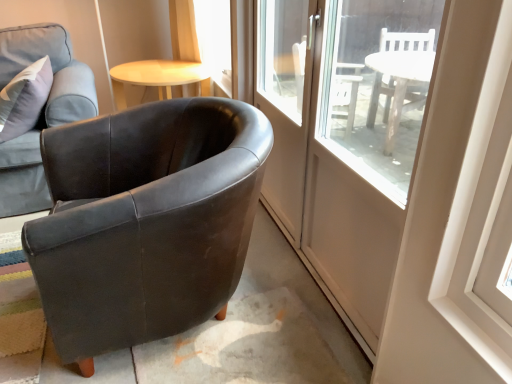
This screenshot has height=384, width=512. I want to click on clear glass door at center, so click(285, 100).

This screenshot has height=384, width=512. I want to click on light wood/woodenobject at upper center, so click(157, 77).

What do you see at coordinates (145, 220) in the screenshot? Image resolution: width=512 pixels, height=384 pixels. I see `matte black armchair at left, which appears as the first chair when viewed from the right` at bounding box center [145, 220].

This screenshot has width=512, height=384. What are the coordinates of `matte black armchair at left, which is the second chair from right to left` in the screenshot? It's located at (41, 111).

Is matte black armchair at left, which is counted as the 2th chair, starting from the left, thinner than clear glass door at center?

No.

Where is `screen door that is on the right side of matte black armchair at left, which is counted as the 2th chair, starting from the left`? Image resolution: width=512 pixels, height=384 pixels. screen door that is on the right side of matte black armchair at left, which is counted as the 2th chair, starting from the left is located at coordinates (285, 100).

From a real-world perspective, which is physically below, matte black armchair at left, which appears as the first chair when viewed from the right, or clear glass door at center?

matte black armchair at left, which appears as the first chair when viewed from the right, is physically lower.

Does light wood/woodenobject at upper center have a larger size compared to matte black armchair at left, which is counted as the 2th chair, starting from the left?

Incorrect, light wood/woodenobject at upper center is not larger than matte black armchair at left, which is counted as the 2th chair, starting from the left.

Which is behind, point (159, 72) or point (116, 324)?

Positioned behind is point (159, 72).

From the image's perspective, which object appears higher, light wood/woodenobject at upper center or matte black armchair at left, which appears as the first chair when viewed from the right?

light wood/woodenobject at upper center, from the image's perspective.

Is light wood/woodenobject at upper center outside of matte black armchair at left, which appears as the first chair when viewed from the right?

Yes, light wood/woodenobject at upper center is located beyond the bounds of matte black armchair at left, which appears as the first chair when viewed from the right.

How many degrees apart are the facing directions of light wood/woodenobject at upper center and matte black armchair at left, which is the second chair from right to left?

light wood/woodenobject at upper center and matte black armchair at left, which is the second chair from right to left, are facing 0.826 degrees away from each other.

Which is less distant, (x=118, y=65) or (x=61, y=83)?

Point (x=118, y=65).

Is matte black armchair at left, which is the second chair from right to left, surrounded by light wood/woodenobject at upper center?

No, matte black armchair at left, which is the second chair from right to left, is not surrounded by light wood/woodenobject at upper center.

Considering the sizes of objects light wood/woodenobject at upper center and matte black armchair at left, the first chair in the left-to-right sequence, in the image provided, who is bigger, light wood/woodenobject at upper center or matte black armchair at left, the first chair in the left-to-right sequence,?

matte black armchair at left, the first chair in the left-to-right sequence.

From the image's perspective, does clear glass door at center appear higher than matte black armchair at left, which appears as the first chair when viewed from the right?

Yes.

Could you tell me if clear glass door at center is facing matte black armchair at left, which appears as the first chair when viewed from the right?

Yes, clear glass door at center is facing matte black armchair at left, which appears as the first chair when viewed from the right.

Is clear glass door at center in front of matte black armchair at left, which appears as the first chair when viewed from the right?

No, clear glass door at center is behind matte black armchair at left, which appears as the first chair when viewed from the right.

Does clear glass door at center contain matte black armchair at left, which is counted as the 2th chair, starting from the left?

No, clear glass door at center does not contain matte black armchair at left, which is counted as the 2th chair, starting from the left.

From the image's perspective, which is below, matte black armchair at left, which is the second chair from right to left, or clear glass door at center?

From the image's view, clear glass door at center is below.

From a real-world perspective, which is physically above, matte black armchair at left, the first chair in the left-to-right sequence, or clear glass door at center?

Answer: In real-world perspective, clear glass door at center is above.

Considering the positions of objects matte black armchair at left, which is the second chair from right to left, and clear glass door at center in the image provided, who is behind, matte black armchair at left, which is the second chair from right to left, or clear glass door at center?

matte black armchair at left, which is the second chair from right to left.

From the image's perspective, which is below, clear glass door at center or light wood/woodenobject at upper center?

clear glass door at center.

Consider the image. Can you confirm if clear glass door at center is shorter than light wood/woodenobject at upper center?

In fact, clear glass door at center may be taller than light wood/woodenobject at upper center.

Which object is closer to the camera, clear glass door at center or light wood/woodenobject at upper center?

clear glass door at center is in front.

How many degrees apart are the facing directions of matte black armchair at left, which appears as the first chair when viewed from the right, and light wood/woodenobject at upper center?

91.7 degrees.

Who is taller, matte black armchair at left, which appears as the first chair when viewed from the right, or light wood/woodenobject at upper center?

Standing taller between the two is matte black armchair at left, which appears as the first chair when viewed from the right.

From the image's perspective, count 2nd chairs downward from the light wood/woodenobject at upper center and point to it. Please provide its 2D coordinates.

[(145, 220)]

In the scene shown: Which of these two, matte black armchair at left, which is counted as the 2th chair, starting from the left, or light wood/woodenobject at upper center, is thinner?

Thinner between the two is light wood/woodenobject at upper center.

Identify the location of chair in front of the clear glass door at center. (145, 220).

At what (x,y) coordinates should I click in order to perform the action: click on chair to the right of light wood/woodenobject at upper center. Please return your answer as a coordinate pair (x, y). This screenshot has width=512, height=384. Looking at the image, I should click on (145, 220).

Which object lies nearer to the anchor point clear glass door at center, matte black armchair at left, which is the second chair from right to left, or matte black armchair at left, which is counted as the 2th chair, starting from the left?

Based on the image, matte black armchair at left, which is counted as the 2th chair, starting from the left, appears to be nearer to clear glass door at center.

Considering their positions, is matte black armchair at left, which appears as the first chair when viewed from the right, positioned further to clear glass door at center than light wood/woodenobject at upper center?

Based on the image, light wood/woodenobject at upper center appears to be further to clear glass door at center.

Looking at the image, which one is located further to matte black armchair at left, which appears as the first chair when viewed from the right, matte black armchair at left, which is the second chair from right to left, or clear glass door at center?

matte black armchair at left, which is the second chair from right to left, is further to matte black armchair at left, which appears as the first chair when viewed from the right.

From the image, which object appears to be nearer to light wood/woodenobject at upper center, clear glass door at center or matte black armchair at left, the first chair in the left-to-right sequence?

matte black armchair at left, the first chair in the left-to-right sequence.

Based on their spatial positions, is matte black armchair at left, which appears as the first chair when viewed from the right, or matte black armchair at left, the first chair in the left-to-right sequence, further from clear glass door at center?

Based on the image, matte black armchair at left, the first chair in the left-to-right sequence, appears to be further to clear glass door at center.

When comparing their distances from light wood/woodenobject at upper center, does matte black armchair at left, the first chair in the left-to-right sequence, or clear glass door at center seem closer?

matte black armchair at left, the first chair in the left-to-right sequence, lies closer to light wood/woodenobject at upper center than the other object.

Based on their spatial positions, is clear glass door at center or light wood/woodenobject at upper center further from matte black armchair at left, which is counted as the 2th chair, starting from the left?

light wood/woodenobject at upper center lies further to matte black armchair at left, which is counted as the 2th chair, starting from the left, than the other object.

Based on their spatial positions, is light wood/woodenobject at upper center or matte black armchair at left, the first chair in the left-to-right sequence, closer to clear glass door at center?

light wood/woodenobject at upper center lies closer to clear glass door at center than the other object.

The height and width of the screenshot is (384, 512). In order to click on chair located between matte black armchair at left, the first chair in the left-to-right sequence, and clear glass door at center in the left-right direction in this screenshot , I will do `click(145, 220)`.

Find the location of a particular element. This screenshot has height=384, width=512. screen door between matte black armchair at left, which appears as the first chair when viewed from the right, and light wood/woodenobject at upper center, along the z-axis is located at coordinates (285, 100).

At what (x,y) coordinates should I click in order to perform the action: click on chair between matte black armchair at left, which is counted as the 2th chair, starting from the left, and light wood/woodenobject at upper center from front to back. Please return your answer as a coordinate pair (x, y). Looking at the image, I should click on (41, 111).

You are a GUI agent. You are given a task and a screenshot of the screen. Output one action in this format:
    pyautogui.click(x=<x>, y=<y>)
    Task: Click on the table situated between matte black armchair at left, the first chair in the left-to-right sequence, and clear glass door at center from left to right
    
    Given the screenshot: What is the action you would take?
    pyautogui.click(x=157, y=77)